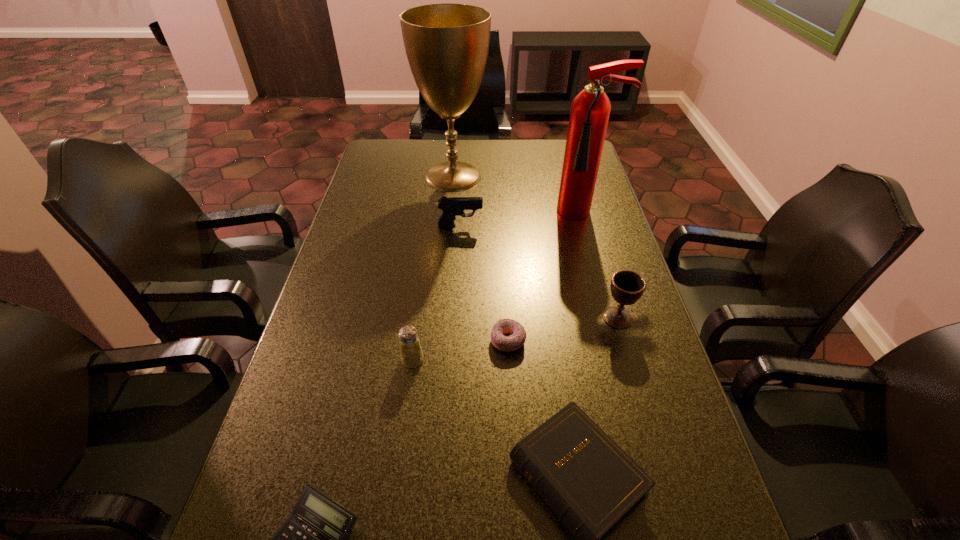
Locate an element on the screen. The height and width of the screenshot is (540, 960). the farthest object is located at coordinates (447, 44).

I want to click on fire extinguisher, so click(x=590, y=109).

Identify the location of chalice. The image size is (960, 540). (627, 287).

Find the location of `pistol`. pistol is located at coordinates (451, 206).

At what (x,y) coordinates should I click in order to perform the action: click on saltshaker. Please return your answer as a coordinate pair (x, y). Looking at the image, I should click on (411, 354).

Find the location of a particular element. This screenshot has width=960, height=540. the seventh tallest object is located at coordinates (517, 338).

This screenshot has width=960, height=540. I want to click on free region located on the back of the farthest object, so click(x=455, y=150).

This screenshot has height=540, width=960. I want to click on free spot located at the nozzle of the fire extinguisher, so click(597, 258).

Where is `vacant space located 0.320m on the back of the sixth shortest object`? vacant space located 0.320m on the back of the sixth shortest object is located at coordinates [592, 232].

The width and height of the screenshot is (960, 540). What are the coordinates of `free region located at the barrel of the pistol` in the screenshot? It's located at (511, 226).